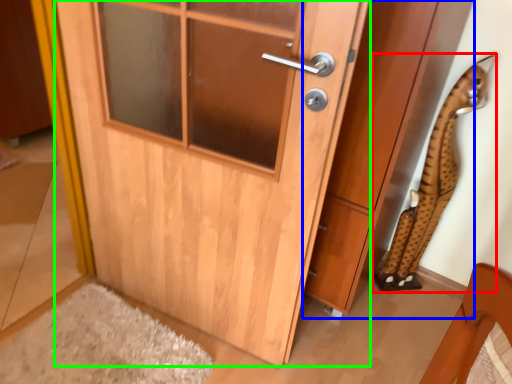
Question: Based on their relative distances, which object is nearer to animal (highlighted by a red box)? Choose from cabinetry (highlighted by a blue box) and door (highlighted by a green box).

Choices:
 (A) cabinetry
 (B) door

Answer: (A)